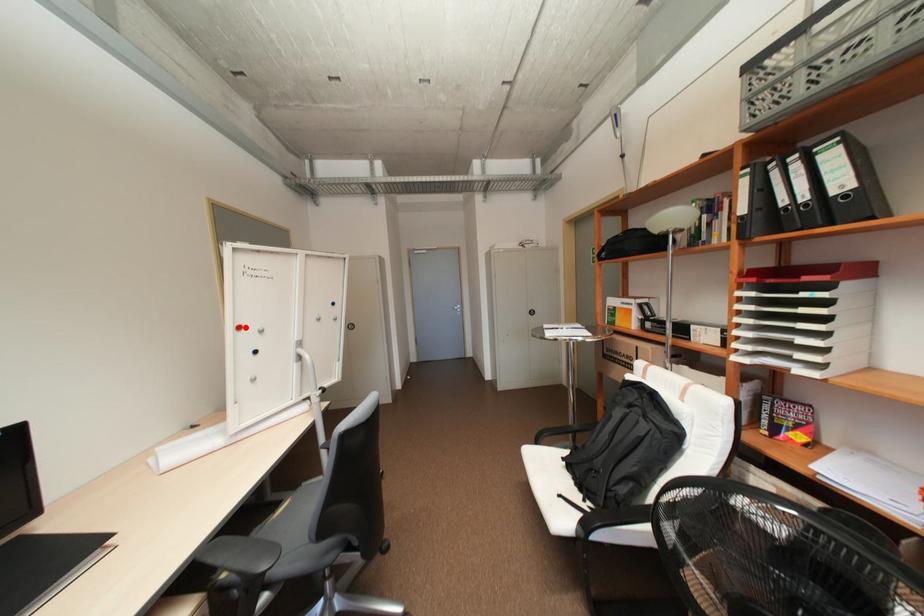
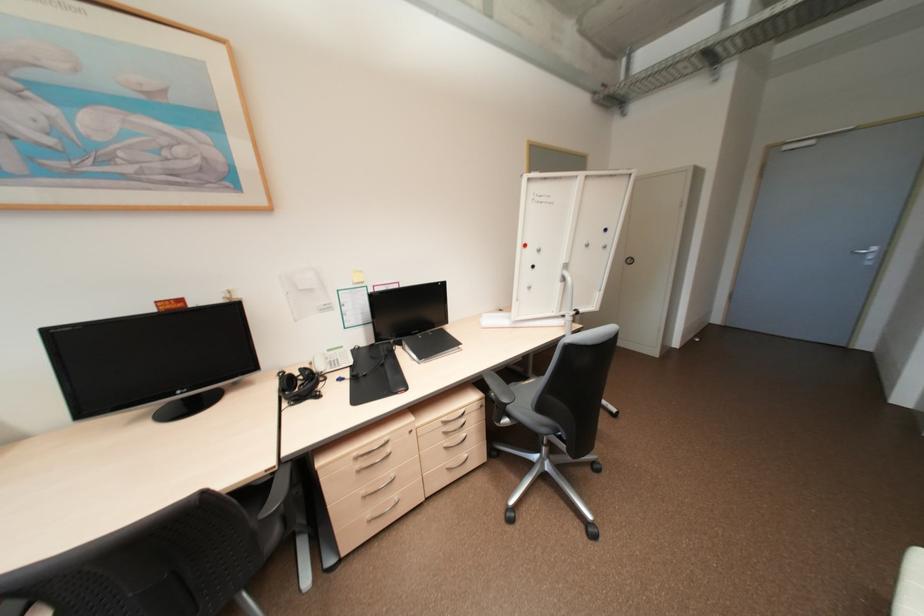
In the second image, find the point that corresponds to the highlighted location in the first image.

(530, 245)